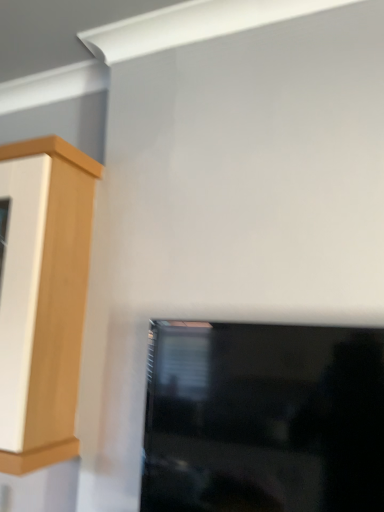
The height and width of the screenshot is (512, 384). Find the location of `matte black tv at lower right`. matte black tv at lower right is located at coordinates (263, 418).

This screenshot has width=384, height=512. What do you see at coordinates (263, 418) in the screenshot?
I see `matte black tv at lower right` at bounding box center [263, 418].

This screenshot has width=384, height=512. Identify the location of matte black tv at lower right. (263, 418).